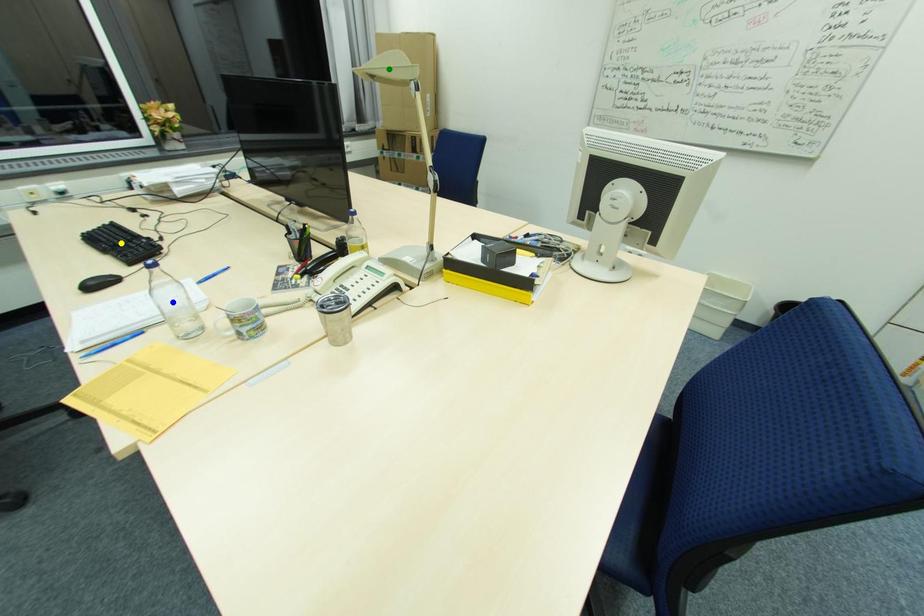
Order these from nearest to farthest:
yellow point, green point, blue point

1. blue point
2. green point
3. yellow point